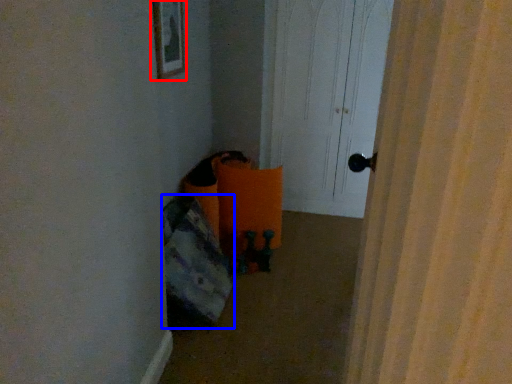
Question: Which point is further to the camera, picture frame (highlighted by a red box) or bean bag chair (highlighted by a blue box)?

Choices:
 (A) picture frame
 (B) bean bag chair

Answer: (A)